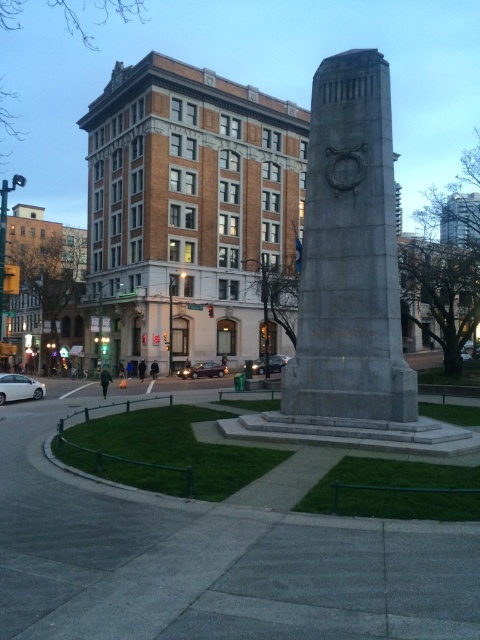
Question: Which of the following is the farthest from the observer?

Choices:
 (A) (211, 372)
 (B) (384, 204)
 (C) (0, 401)

Answer: (A)

Question: Does metallic maroon sedan at center appear over shiny silver sedan at center?

Choices:
 (A) yes
 (B) no

Answer: (B)

Question: Which of the following is the closest to the observer?

Choices:
 (A) shiny silver sedan at center
 (B) white matte car at lower left

Answer: (B)

Question: Can you confirm if gray stone monument at center is thinner than white matte car at lower left?

Choices:
 (A) yes
 (B) no

Answer: (B)

Question: Can you confirm if white matte car at lower left is positioned to the right of shiny silver sedan at center?

Choices:
 (A) no
 (B) yes

Answer: (A)

Question: Which point is farther to the camera?

Choices:
 (A) [212, 371]
 (B) [17, 385]
 (C) [275, 365]

Answer: (A)